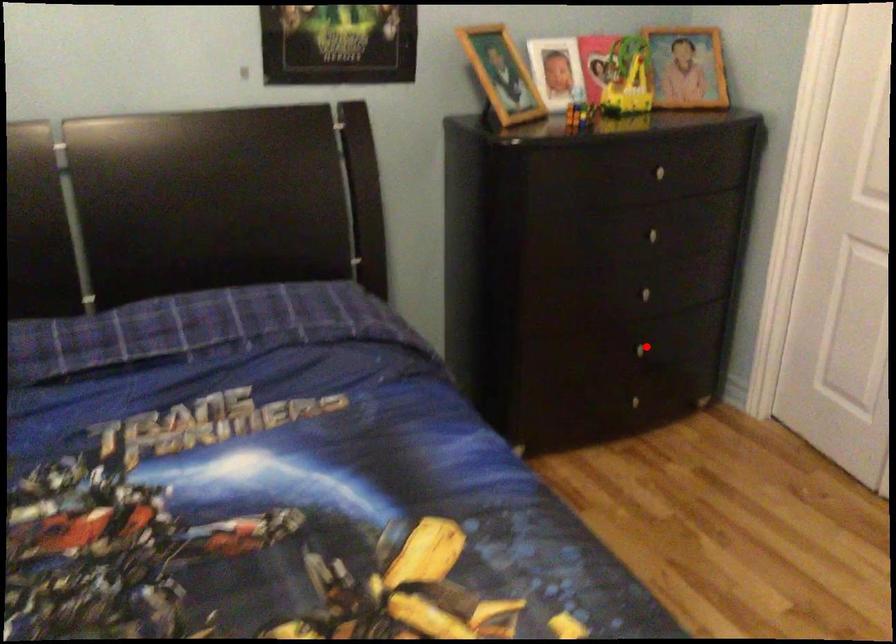
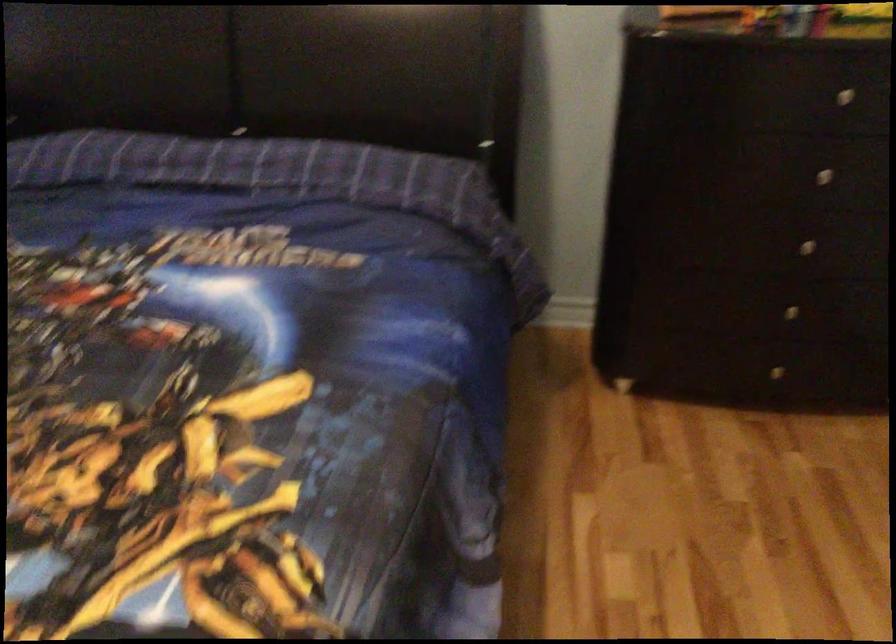
Question: I am providing you with two images of the same scene from different viewpoints. A red point is marked on the first image. At the location where the point appears in image 1, is it still visible in image 2?

Choices:
 (A) Yes
 (B) No

Answer: (A)